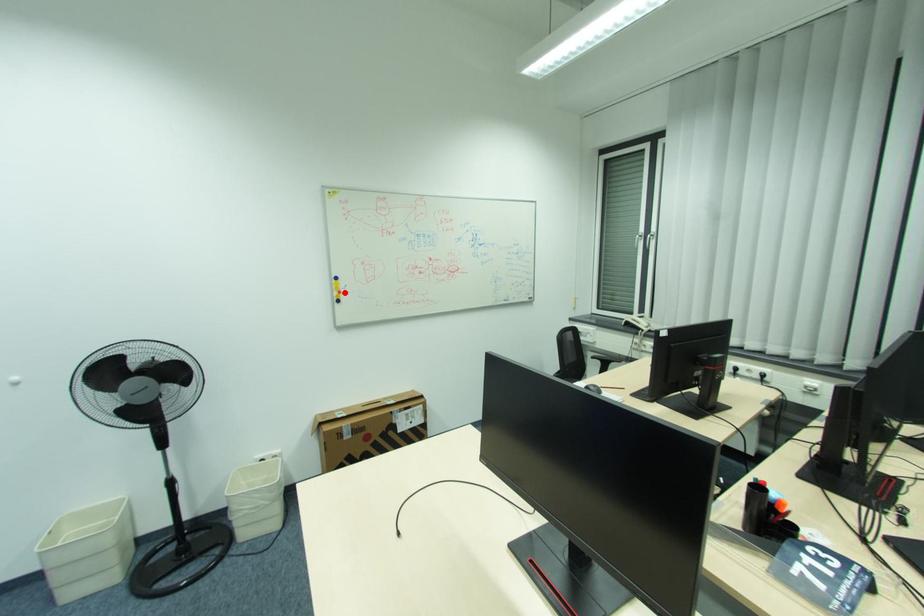
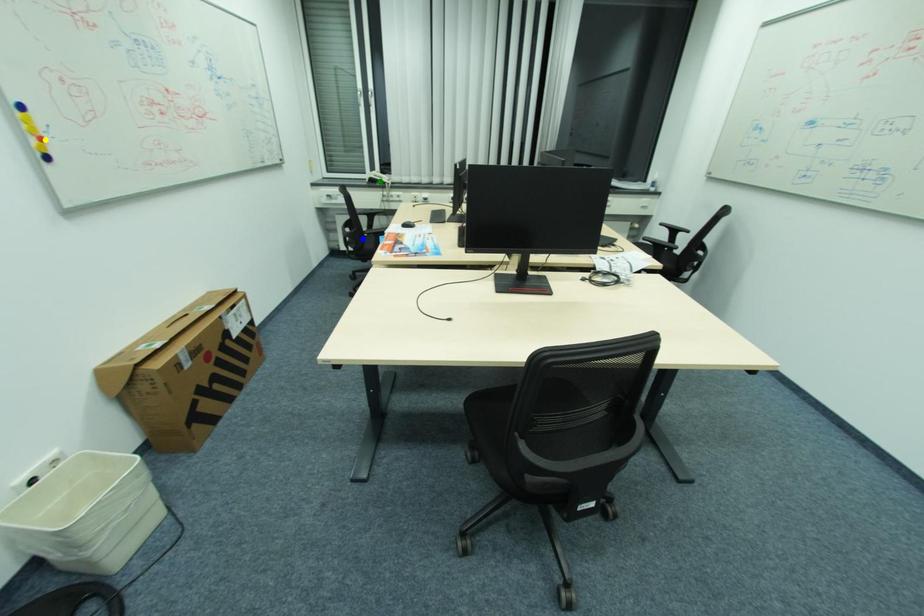
Question: I am providing you with two images of the same scene from different viewpoints. A red point is marked on the first image. You are given multiple points on the second image. Which point in image 2 represents the same 3d spot as the red point in image 1?

Choices:
 (A) green point
 (B) blue point
 (C) yellow point

Answer: (C)